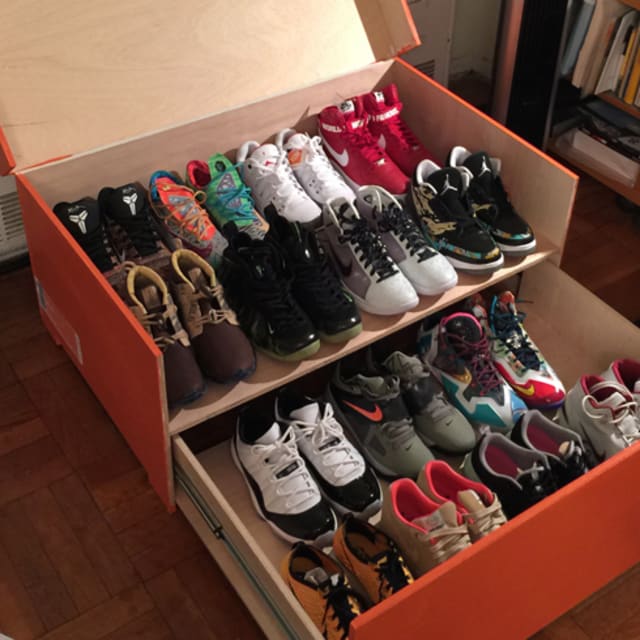
This screenshot has width=640, height=640. Find the location of `bookshelf`. bookshelf is located at coordinates (617, 105).